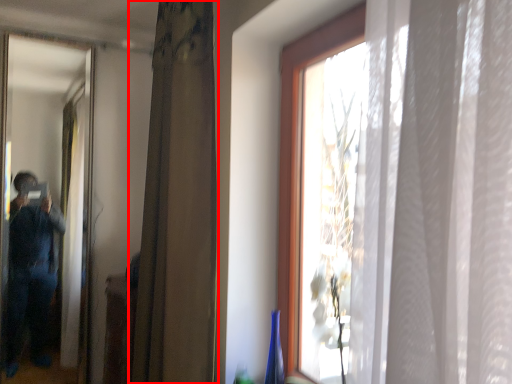
Question: From the image's perspective, what is the correct spatial positioning of curtain (annotated by the red box) in reference to mirror?

Choices:
 (A) below
 (B) above

Answer: (B)